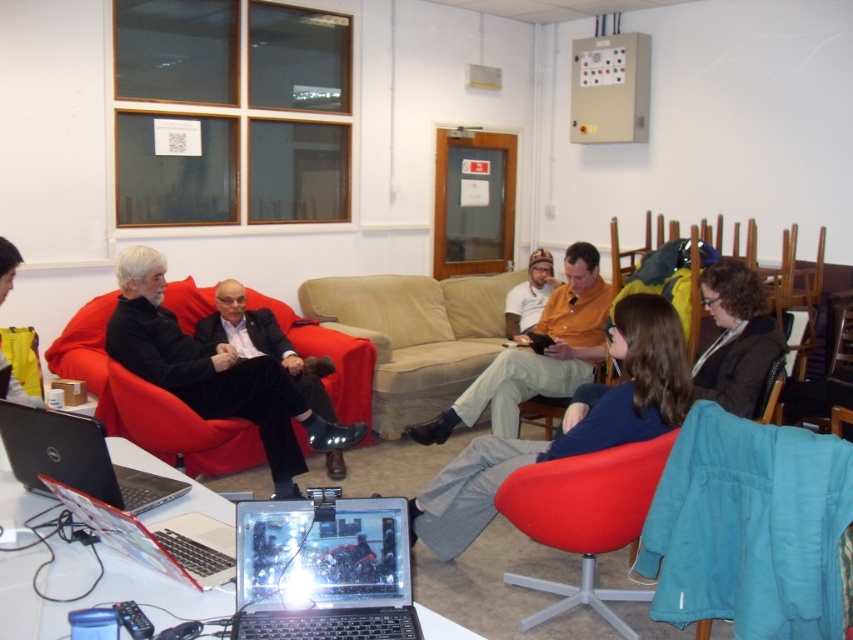
In order to click on orange cotton shirt at center in this screenshot , I will do `click(537, 355)`.

Between orange cotton shirt at center and wooden chair at center, which one appears on the left side from the viewer's perspective?

orange cotton shirt at center is more to the left.

Does point (566, 340) come farther from viewer compared to point (610, 252)?

No, (566, 340) is closer to viewer.

What are the coordinates of `orange cotton shirt at center` in the screenshot? It's located at (537, 355).

Between blue cotton shirt at center and orange cotton shirt at center, which one is positioned lower?

blue cotton shirt at center

Which is behind, point (567, 436) or point (508, 420)?

Point (508, 420)

Describe the element at coordinates (566, 426) in the screenshot. I see `blue cotton shirt at center` at that location.

Find the location of `blue cotton shirt at center`. blue cotton shirt at center is located at coordinates (566, 426).

Based on the photo, measure the distance between matte red armchair at lower center and white knit hat at center.

They are 9.53 feet apart.

Is point (612, 464) positioned before point (538, 304)?

Yes.

You are a GUI agent. You are given a task and a screenshot of the screen. Output one action in this format:
    pyautogui.click(x=<x>, y=<y>)
    Task: Click on the matte red armchair at lower center
    The width and height of the screenshot is (853, 640).
    Given the screenshot: What is the action you would take?
    pyautogui.click(x=584, y=516)